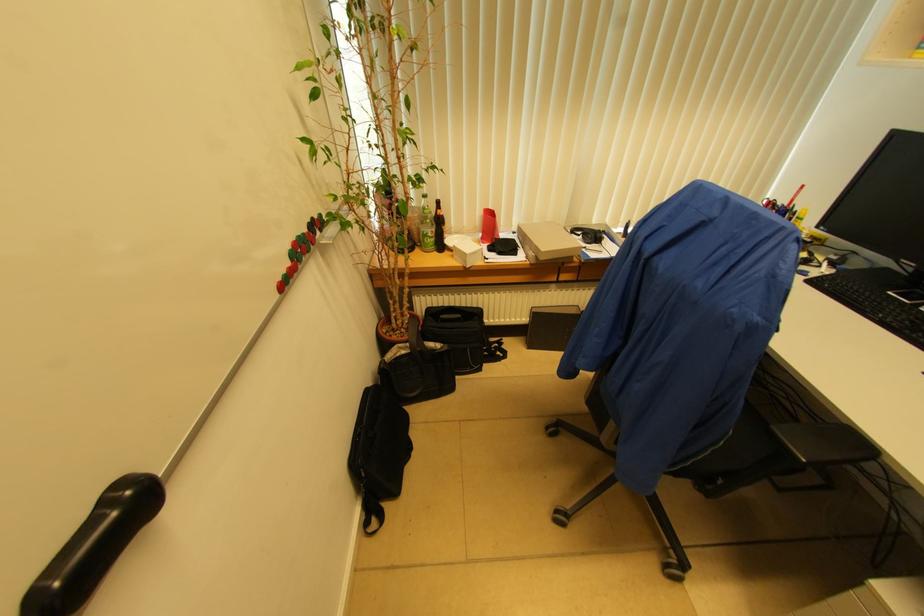
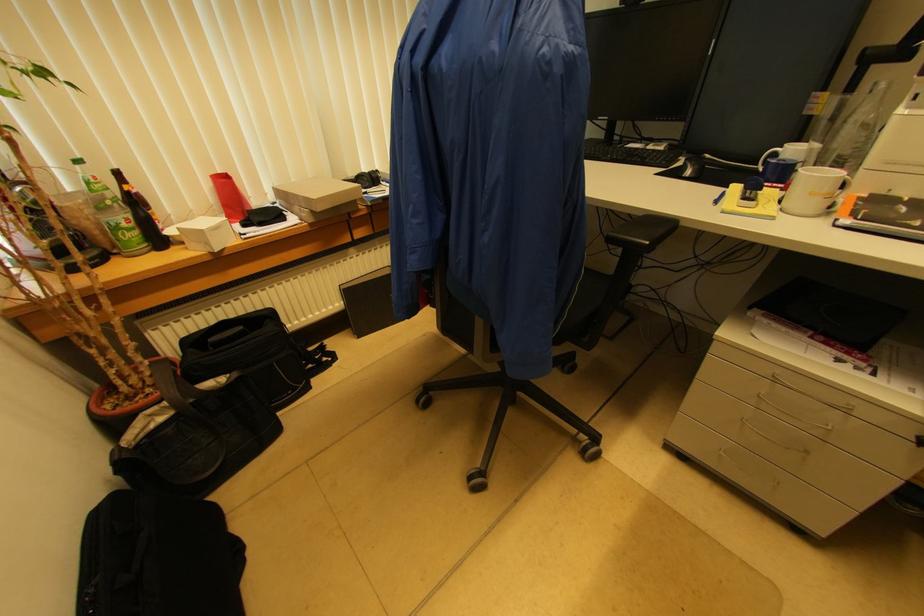
Where in the second image is the point corresponding to [411,350] from the first image?

(175, 408)